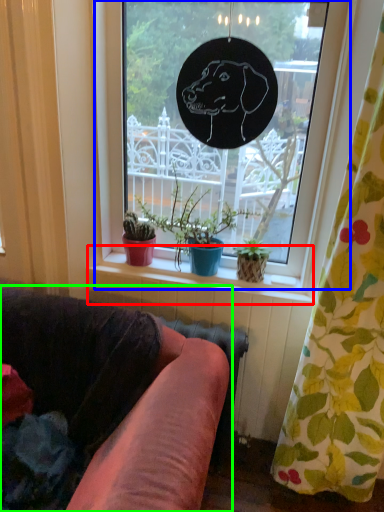
Question: Based on their relative distances, which object is nearer to window sill (highlighted by a red box)? Choose from window (highlighted by a blue box) and studio couch (highlighted by a green box).

Choices:
 (A) window
 (B) studio couch

Answer: (A)